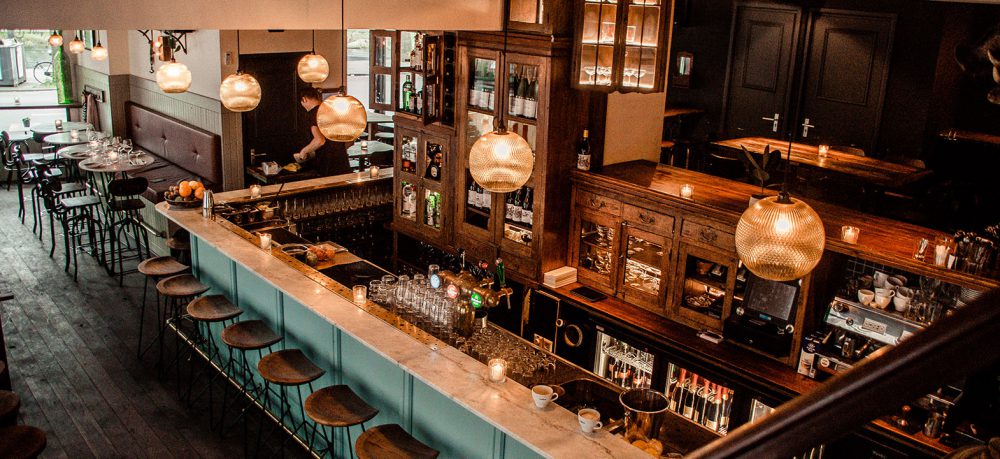
Find the location of `bar stools with backs at high top tables`. bar stools with backs at high top tables is located at coordinates (7, 138), (21, 153), (39, 165), (52, 183), (131, 187).